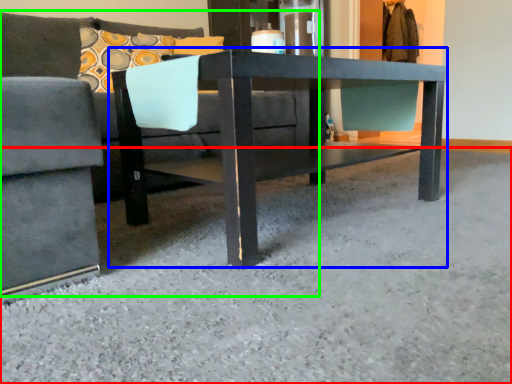
Question: Estimate the real-world distances between objects in this image. Which object is closer to concrete (highlighted by a red box), table (highlighted by a blue box) or studio couch (highlighted by a green box)?

Choices:
 (A) table
 (B) studio couch

Answer: (A)